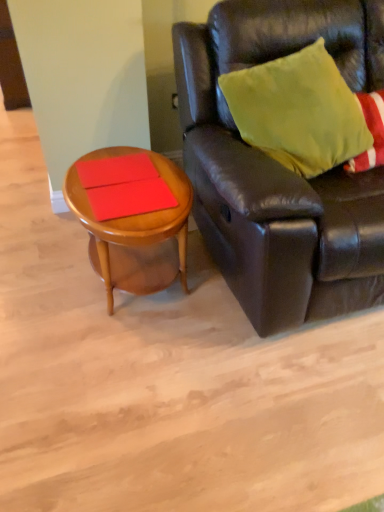
Where is `spots to the right of woodenobject at left`? This screenshot has width=384, height=512. spots to the right of woodenobject at left is located at coordinates (225, 302).